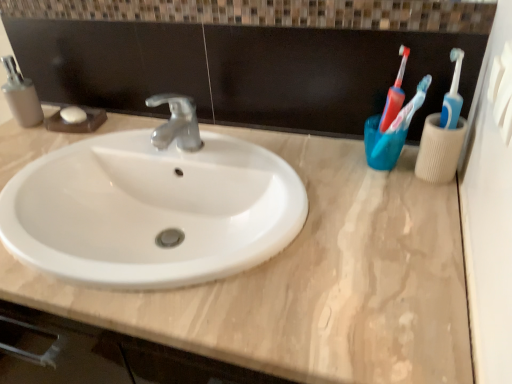
Image resolution: width=512 pixels, height=384 pixels. Describe the element at coordinates (21, 96) in the screenshot. I see `matte gray soap dispenser at left` at that location.

What are the coordinates of `beige marble counter top at center` in the screenshot? It's located at (312, 281).

From a real-world perspective, which object stands above the other?

In real-world perspective, translucent blue toothbrush at upper right is above.

Does beige marble counter top at center have a greater width compared to translucent blue toothbrush at upper right?

Yes.

Is beige marble counter top at center at the right side of translucent blue toothbrush at upper right?

No, beige marble counter top at center is not to the right of translucent blue toothbrush at upper right.

Could you measure the distance between beige marble counter top at center and translucent blue toothbrush at upper right?

They are 28.99 centimeters apart.

Consider the image. Could you tell me if translucent blue toothbrush at upper right is facing matte gray soap dispenser at left?

No, translucent blue toothbrush at upper right is not facing towards matte gray soap dispenser at left.

Based on the photo, does translucent blue toothbrush at upper right have a larger size compared to matte gray soap dispenser at left?

Actually, translucent blue toothbrush at upper right might be smaller than matte gray soap dispenser at left.

From a real-world perspective, does translucent blue toothbrush at upper right stand above matte gray soap dispenser at left?

Yes.

Considering the positions of objects matte gray soap dispenser at left and translucent blue toothbrush at upper right in the image provided, who is more to the right, matte gray soap dispenser at left or translucent blue toothbrush at upper right?

translucent blue toothbrush at upper right.

From a real-world perspective, between matte gray soap dispenser at left and translucent blue toothbrush at upper right, who is vertically lower?

In real-world perspective, matte gray soap dispenser at left is lower.

Considering the sizes of matte gray soap dispenser at left and translucent blue toothbrush at upper right in the image, is matte gray soap dispenser at left bigger or smaller than translucent blue toothbrush at upper right?

Clearly, matte gray soap dispenser at left is larger in size than translucent blue toothbrush at upper right.

Considering the relative sizes of matte gray soap dispenser at left and translucent blue toothbrush at upper right in the image provided, is matte gray soap dispenser at left wider than translucent blue toothbrush at upper right?

Correct, the width of matte gray soap dispenser at left exceeds that of translucent blue toothbrush at upper right.

Which object is further away from the camera, matte gray soap dispenser at left or beige marble counter top at center?

matte gray soap dispenser at left.

Who is smaller, matte gray soap dispenser at left or beige marble counter top at center?

matte gray soap dispenser at left is smaller.

Between matte gray soap dispenser at left and beige marble counter top at center, which one appears on the right side from the viewer's perspective?

beige marble counter top at center is more to the right.

Which object is wider, matte gray soap dispenser at left or beige marble counter top at center?

beige marble counter top at center is wider.

Can you tell me how much translucent blue toothbrush at upper right and beige marble counter top at center differ in facing direction?

There is a 2.52-degree angle between the facing directions of translucent blue toothbrush at upper right and beige marble counter top at center.

Between point (390, 125) and point (256, 346), which one is positioned behind?

The point (390, 125) is farther from the camera.

Is translucent blue toothbrush at upper right bigger or smaller than beige marble counter top at center?

translucent blue toothbrush at upper right is smaller than beige marble counter top at center.

Which object is closer to the camera taking this photo, translucent blue toothbrush at upper right or beige marble counter top at center?

beige marble counter top at center.

Is matte gray soap dispenser at left surrounded by beige marble counter top at center?

No, matte gray soap dispenser at left is not inside beige marble counter top at center.

Considering the relative sizes of beige marble counter top at center and matte gray soap dispenser at left in the image provided, is beige marble counter top at center smaller than matte gray soap dispenser at left?

No, beige marble counter top at center is not smaller than matte gray soap dispenser at left.

Who is taller, beige marble counter top at center or matte gray soap dispenser at left?

Standing taller between the two is matte gray soap dispenser at left.

You are a GUI agent. You are given a task and a screenshot of the screen. Output one action in this format:
    pyautogui.click(x=<x>, y=<y>)
    Task: Click on the toothbrush located on the right of beige marble counter top at center
    The image size is (512, 384).
    Given the screenshot: What is the action you would take?
    pyautogui.click(x=403, y=116)

This screenshot has width=512, height=384. Identify the location of mouthwash on the left of translucent blue toothbrush at upper right. (21, 96).

Looking at the image, which one is located further to matte gray soap dispenser at left, beige marble counter top at center or translucent blue toothbrush at upper right?

Among the two, translucent blue toothbrush at upper right is located further to matte gray soap dispenser at left.

When comparing their distances from beige marble counter top at center, does matte gray soap dispenser at left or translucent blue toothbrush at upper right seem closer?

The object closer to beige marble counter top at center is translucent blue toothbrush at upper right.

Based on their spatial positions, is matte gray soap dispenser at left or beige marble counter top at center closer to translucent blue toothbrush at upper right?

beige marble counter top at center is positioned closer to the anchor translucent blue toothbrush at upper right.

Estimate the real-world distances between objects in this image. Which object is closer to matte gray soap dispenser at left, translucent blue toothbrush at upper right or beige marble counter top at center?

Among the two, beige marble counter top at center is located nearer to matte gray soap dispenser at left.

Considering their positions, is translucent blue toothbrush at upper right positioned closer to beige marble counter top at center than matte gray soap dispenser at left?

translucent blue toothbrush at upper right lies closer to beige marble counter top at center than the other object.

Based on their spatial positions, is beige marble counter top at center or matte gray soap dispenser at left further from translucent blue toothbrush at upper right?

Among the two, matte gray soap dispenser at left is located further to translucent blue toothbrush at upper right.

Identify the location of counter top located between matte gray soap dispenser at left and translucent blue toothbrush at upper right in the left-right direction. This screenshot has width=512, height=384. (312, 281).